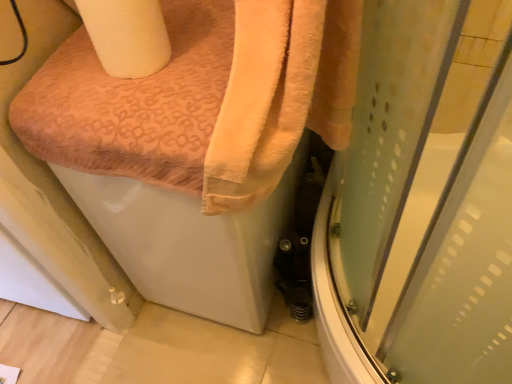
This screenshot has height=384, width=512. Find the location of `free region on the left part of white matte toilet paper at upper left`. free region on the left part of white matte toilet paper at upper left is located at coordinates (65, 65).